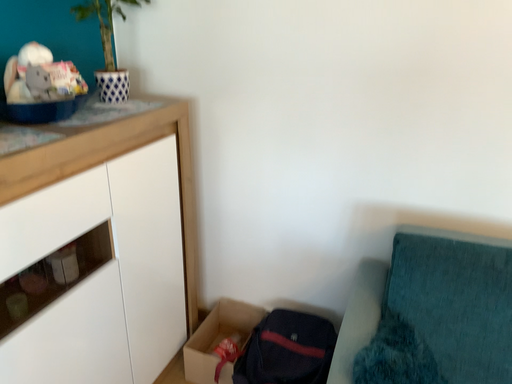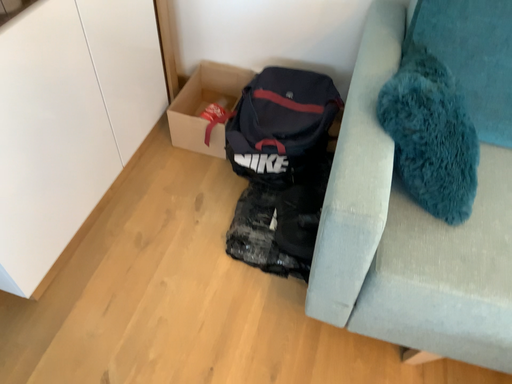
Question: Which way did the camera rotate in the video?

Choices:
 (A) rotated upward
 (B) rotated downward

Answer: (B)